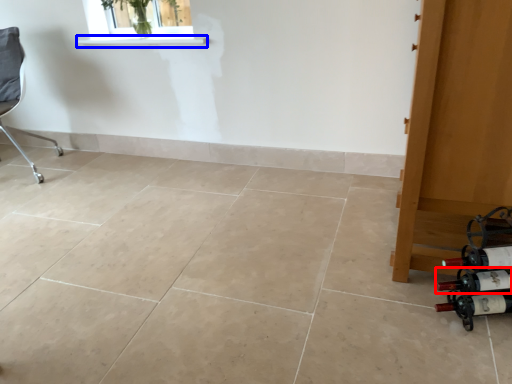
Question: Which object appears closest to the camera in this image, wine bottle (highlighted by a red box) or window sill (highlighted by a blue box)?

Choices:
 (A) wine bottle
 (B) window sill

Answer: (A)